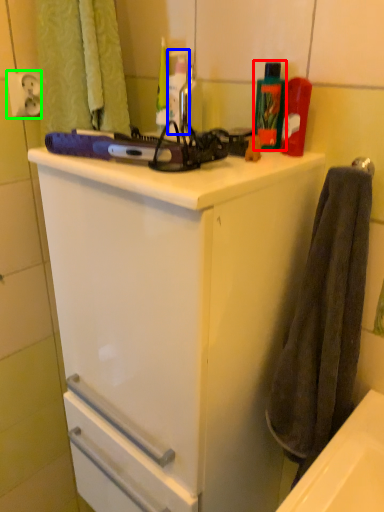
Question: Which object is the closest to the cleaning product (highlighted by a red box)? Choose among these: bottle (highlighted by a blue box) or electric outlet (highlighted by a green box).

Choices:
 (A) bottle
 (B) electric outlet

Answer: (A)